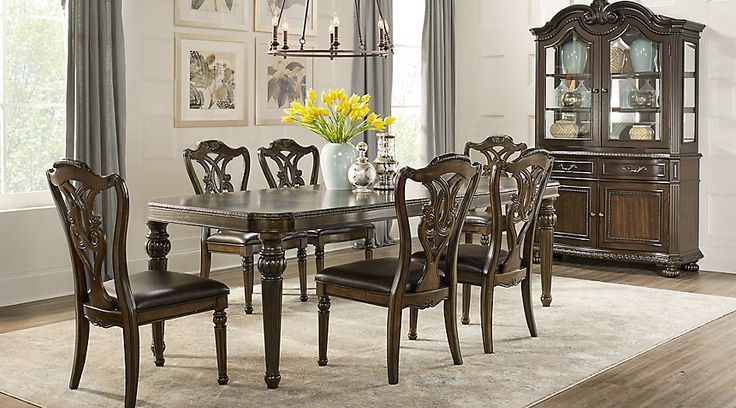
Image resolution: width=736 pixels, height=408 pixels. In order to click on decorations in this screenshot , I will do `click(642, 50)`, `click(620, 54)`, `click(572, 48)`, `click(573, 101)`, `click(647, 103)`, `click(643, 136)`, `click(570, 122)`.